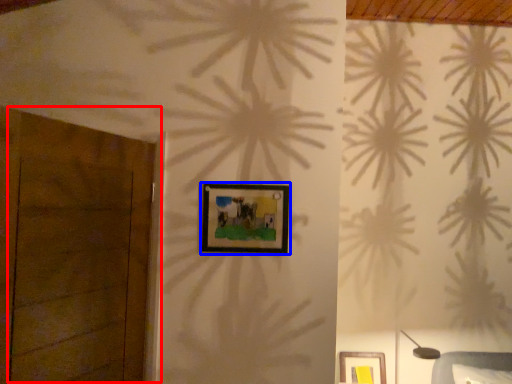
Question: Among these objects, which one is nearest to the camera, door (highlighted by a red box) or picture frame (highlighted by a blue box)?

Choices:
 (A) door
 (B) picture frame

Answer: (A)